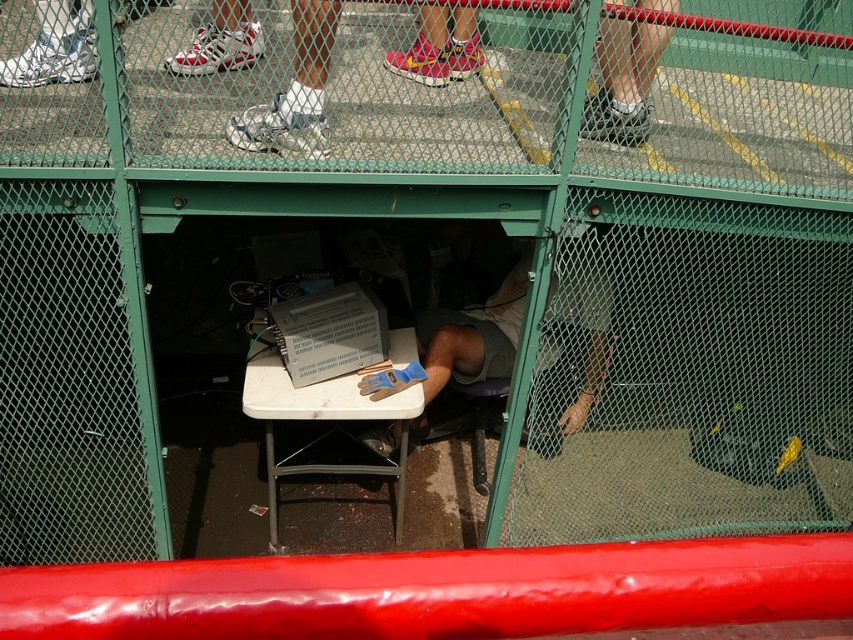
Question: Which of the following is the farthest from the observer?

Choices:
 (A) white plastic table at center
 (B) white fabric socks at upper right

Answer: (A)

Question: Considering the relative positions of white plastic table at center and white fabric socks at upper right in the image provided, where is white plastic table at center located with respect to white fabric socks at upper right?

Choices:
 (A) right
 (B) left

Answer: (B)

Question: Among these points, which one is nearest to the camera?

Choices:
 (A) (421, 397)
 (B) (505, 364)
 (C) (624, 90)

Answer: (C)

Question: Which point is farther to the camera?

Choices:
 (A) (608, 68)
 (B) (589, 403)
 (C) (350, 381)

Answer: (B)

Question: Considering the relative positions of gray fabric shirt at center and white plastic table at center in the image provided, where is gray fabric shirt at center located with respect to white plastic table at center?

Choices:
 (A) left
 (B) right

Answer: (B)

Question: Is gray fabric shirt at center positioned before white fabric socks at upper right?

Choices:
 (A) yes
 (B) no

Answer: (A)